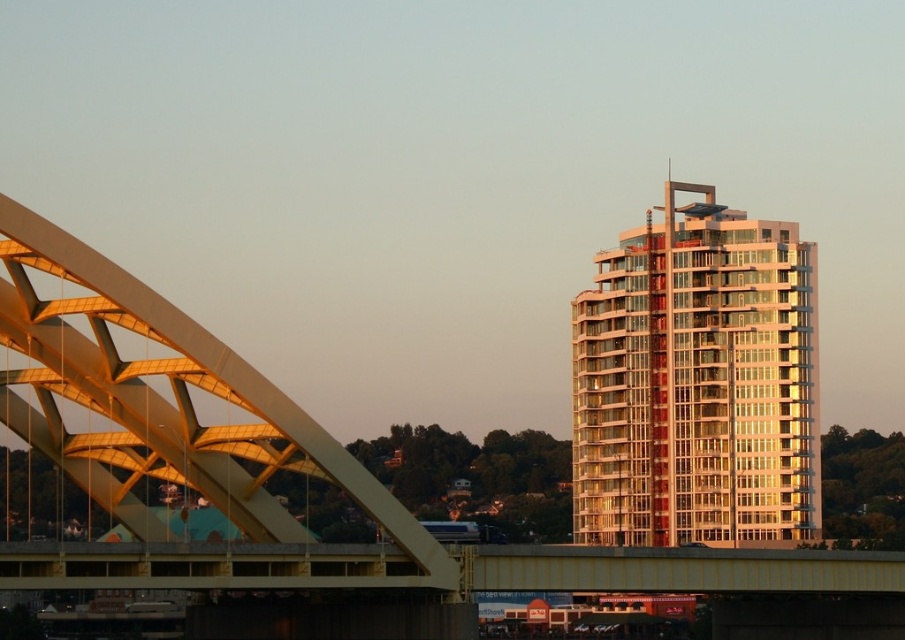
Is gold reflective glass building at upper right taller than golden metallic arch bridge at left?

Indeed, gold reflective glass building at upper right has a greater height compared to golden metallic arch bridge at left.

Can you confirm if gold reflective glass building at upper right is thinner than golden metallic arch bridge at left?

Yes, gold reflective glass building at upper right is thinner than golden metallic arch bridge at left.

From the picture: Who is more forward, (x=653, y=481) or (x=7, y=291)?

Point (x=7, y=291) is in front.

At what (x,y) coordinates should I click in order to perform the action: click on gold reflective glass building at upper right. Please return your answer as a coordinate pair (x, y). This screenshot has width=905, height=640. Looking at the image, I should click on (696, 381).